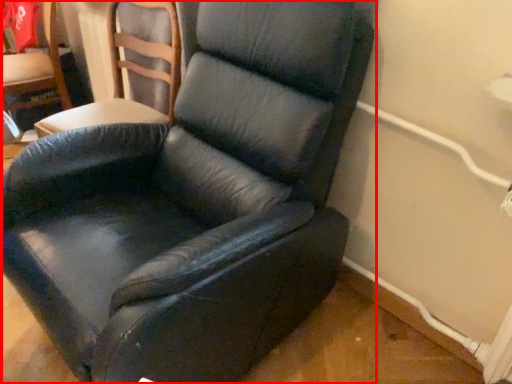
Question: Where is chair (annotated by the red box) located in relation to chair in the image?

Choices:
 (A) right
 (B) left

Answer: (A)